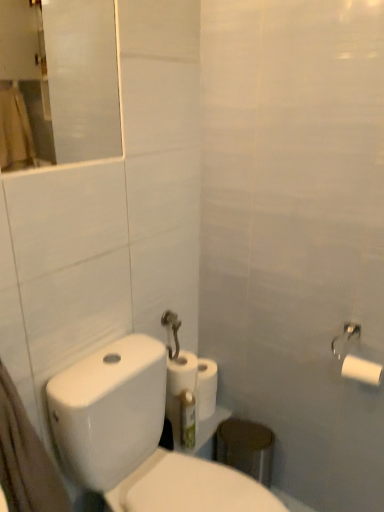
Question: Is transparent glass mirror at upper left inside or outside of white matte toilet paper at center, the 3th toilet paper from the front?

Choices:
 (A) outside
 (B) inside

Answer: (A)

Question: From the image's perspective, is transparent glass mirror at upper left located above or below white matte toilet paper at center, the 1th toilet paper from the left?

Choices:
 (A) above
 (B) below

Answer: (A)

Question: Estimate the real-world distances between objects in this image. Which object is farther from the white glossy toilet at lower left?

Choices:
 (A) white matte toilet paper at right, placed as the 2th toilet paper when sorted from right to left
 (B) white matte toilet paper at upper right, arranged as the 2th toilet paper when viewed from the front
 (C) green plastic toothbrush at lower center
 (D) white matte paper towel at center
 (E) white matte toilet paper at center, positioned as the third toilet paper in right-to-left order

Answer: (A)

Question: Estimate the real-world distances between objects in this image. Which object is farther from the white glossy toilet at lower left?

Choices:
 (A) white matte toilet paper at right, placed as the 2th toilet paper when sorted from right to left
 (B) white matte paper towel at center
 (C) white matte toilet paper at center, positioned as the third toilet paper in right-to-left order
 (D) white matte toilet paper at upper right, the first toilet paper in the right-to-left sequence
 (E) transparent glass mirror at upper left

Answer: (E)